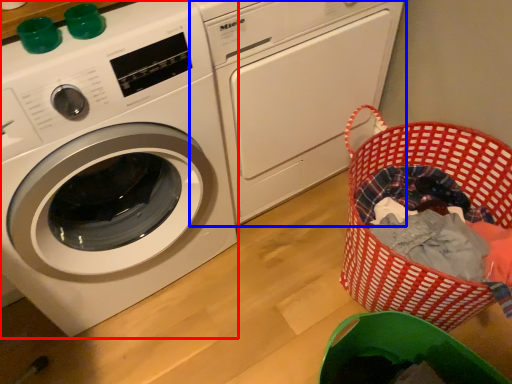
Question: Among these objects, which one is nearest to the camera, washing machine (highlighted by a red box) or washing machine (highlighted by a blue box)?

Choices:
 (A) washing machine
 (B) washing machine

Answer: (A)